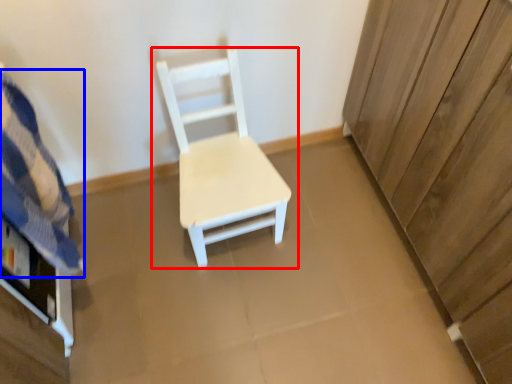
Question: Among these objects, which one is farthest to the camera, chair (highlighted by a red box) or bedding (highlighted by a blue box)?

Choices:
 (A) chair
 (B) bedding

Answer: (A)